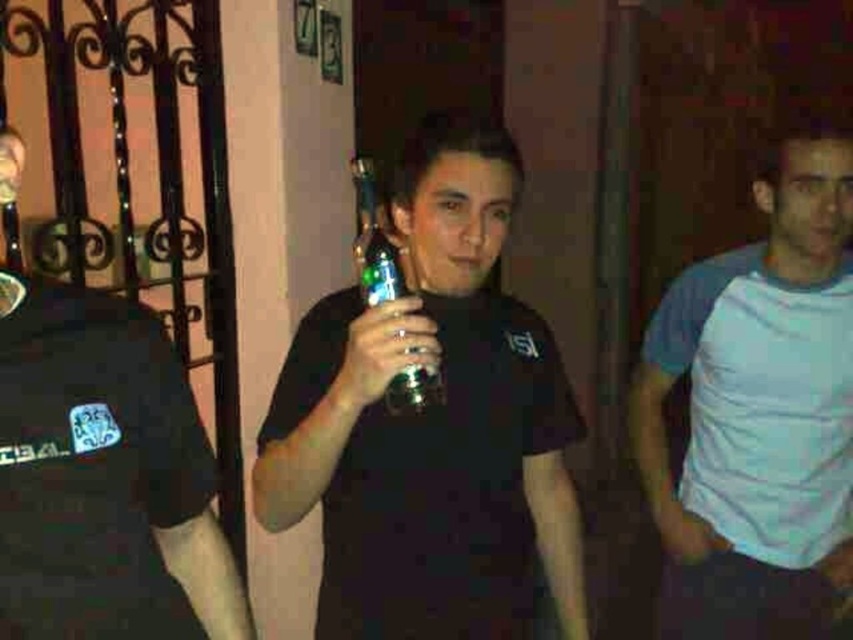
You are a photographer trying to frame a shot of the matte black bottle at center. The camera has a grid overlay with coordinates from 0 to 1 on both axes. Where exactly should you position the bottle to ensure it stays centered in the frame?

The matte black bottle at center is already positioned at coordinates point (431, 422), so to keep it centered, aim for that exact point on the grid overlay.